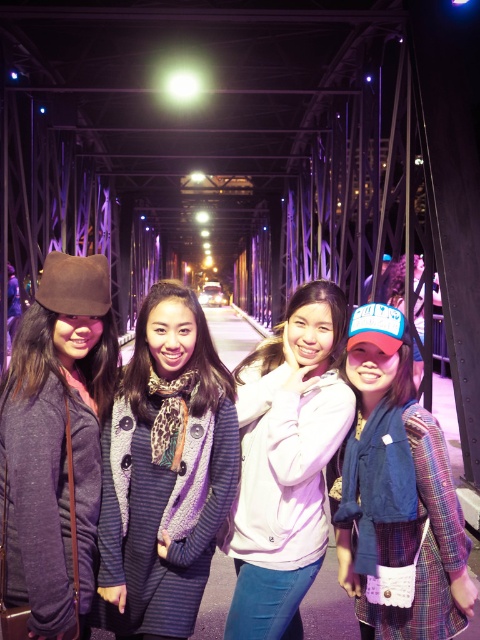
Question: Which point is farther to the camera?

Choices:
 (A) (414, 540)
 (B) (184, 385)

Answer: (A)

Question: Can you confirm if striped wool coat at center is positioned to the right of brown suede hat at left?

Choices:
 (A) yes
 (B) no

Answer: (A)

Question: Estimate the real-world distances between objects in this image. Which object is closer to the blue fabric cap at right?

Choices:
 (A) striped wool coat at center
 (B) brown suede hat at left
 (C) pink fleece jacket at center

Answer: (C)

Question: Which object appears closest to the camera in this image?

Choices:
 (A) pink fleece jacket at center
 (B) blue fabric cap at right

Answer: (B)

Question: Is striped wool coat at center above brown suede hat at left?

Choices:
 (A) no
 (B) yes

Answer: (A)

Question: Can you confirm if striped wool coat at center is wider than brown suede hat at left?

Choices:
 (A) no
 (B) yes

Answer: (B)